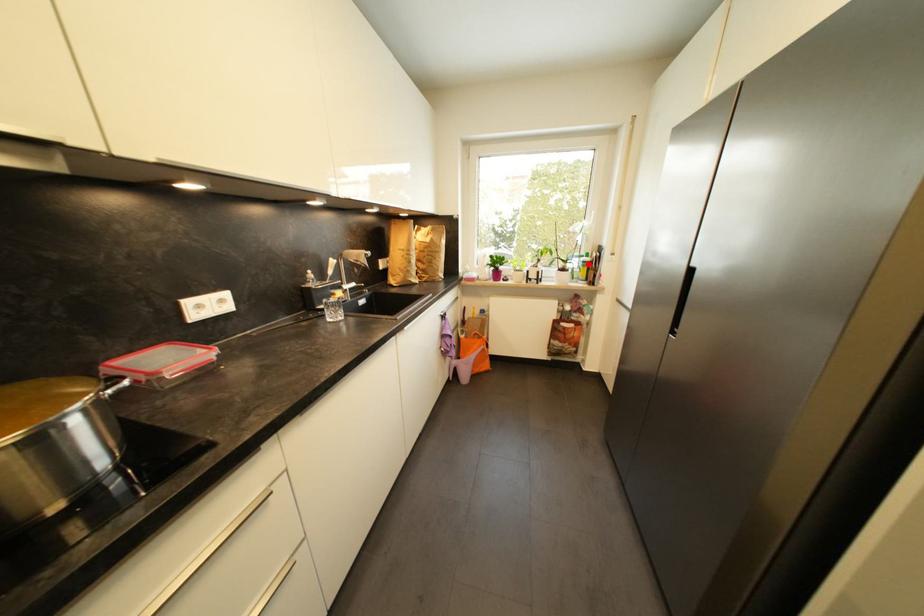
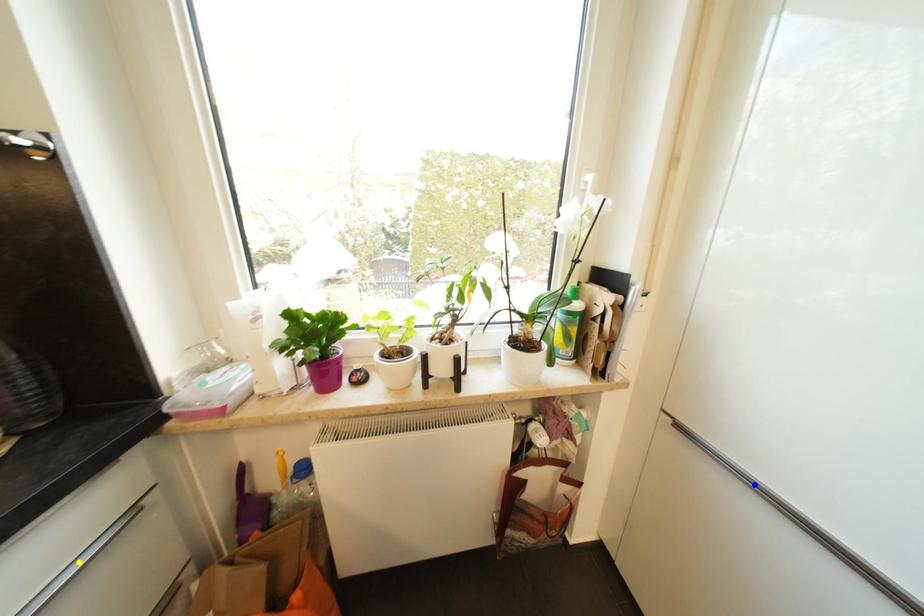
Question: I am providing you with two images of the same scene from different viewpoints. A red point is marked on the first image. You are given multiple points on the second image. In image 2, which mark is for the same physical point as the one in image 1?

Choices:
 (A) blue point
 (B) green point
 (C) yellow point

Answer: (B)